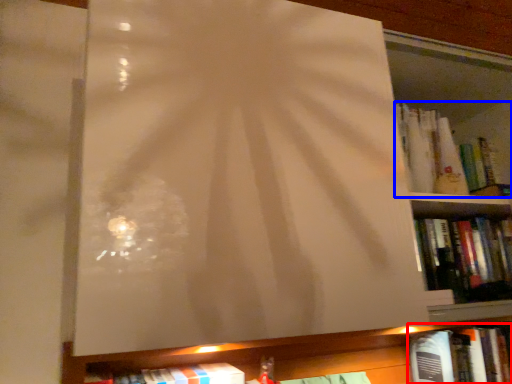
Question: Which of the following is the farthest to the observer, book (highlighted by a red box) or book (highlighted by a blue box)?

Choices:
 (A) book
 (B) book

Answer: (A)